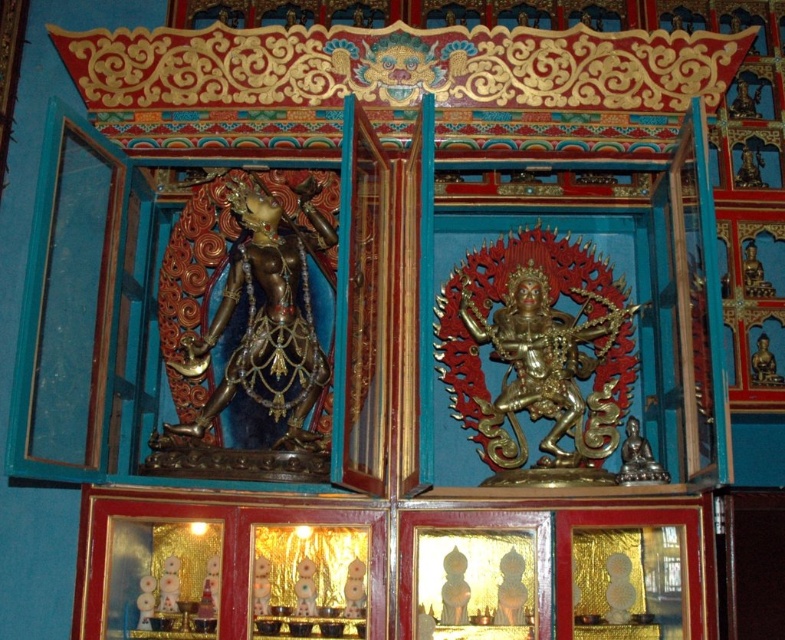
Question: Which of the following is the farthest from the observer?

Choices:
 (A) (294, 243)
 (B) (528, 456)

Answer: (A)

Question: Where is gold metallic statue at center located in relation to gold-bronze statue at left in the image?

Choices:
 (A) left
 (B) right

Answer: (B)

Question: Which point is closer to the camera?

Choices:
 (A) (309, 374)
 (B) (520, 257)

Answer: (A)

Question: Where is gold metallic statue at center located in relation to gold-bronze statue at left in the image?

Choices:
 (A) below
 (B) above

Answer: (A)

Question: Is gold metallic statue at center thinner than gold-bronze statue at left?

Choices:
 (A) yes
 (B) no

Answer: (B)